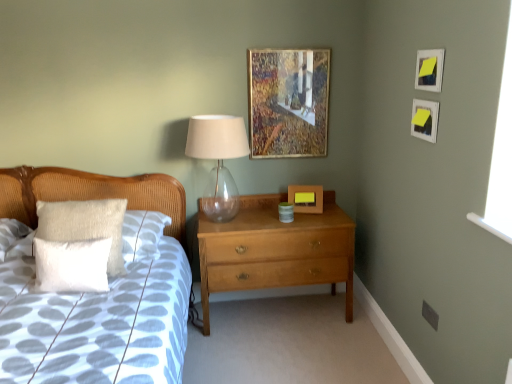
Find the location of `free spot in front of light brown wood chest of drawers at center`. free spot in front of light brown wood chest of drawers at center is located at coordinates (284, 354).